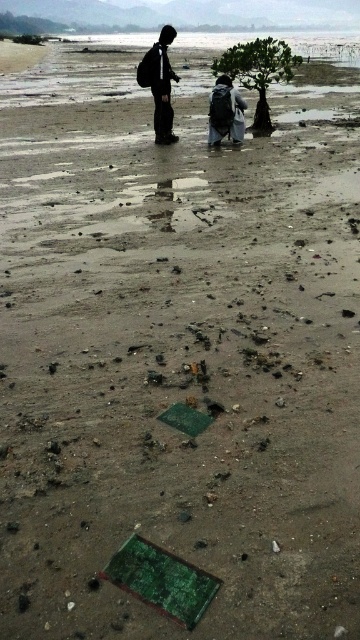
Is point (236, 44) positioned before point (219, 99)?

No, (236, 44) is behind (219, 99).

Does point (258, 118) come behind point (234, 93)?

Yes, it is behind point (234, 93).

Where is `green leafy tree at center`? green leafy tree at center is located at coordinates (258, 72).

Measure the distance from black matte backpack at upper center to dark gray backpack at center.

black matte backpack at upper center is 36.58 inches away from dark gray backpack at center.

Between black matte backpack at upper center and dark gray backpack at center, which one is positioned higher?

Positioned higher is black matte backpack at upper center.

Locate an element on the screen. This screenshot has height=640, width=360. black matte backpack at upper center is located at coordinates (159, 83).

Who is positioned more to the right, green leafy tree at center or black matte backpack at upper center?

From the viewer's perspective, green leafy tree at center appears more on the right side.

Is green leafy tree at center to the left of black matte backpack at upper center from the viewer's perspective?

In fact, green leafy tree at center is to the right of black matte backpack at upper center.

You are a GUI agent. You are given a task and a screenshot of the screen. Output one action in this format:
    pyautogui.click(x=<x>, y=<y>)
    Task: Click on the green leafy tree at center
    
    Given the screenshot: What is the action you would take?
    pyautogui.click(x=258, y=72)